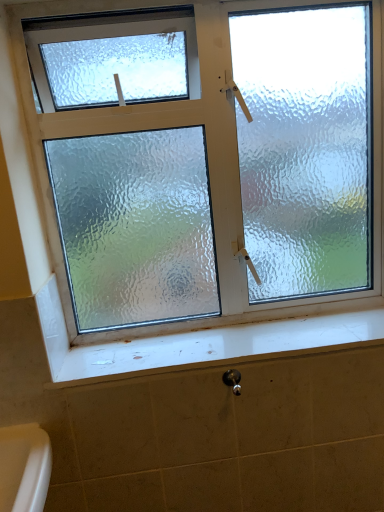
Identify the location of vacant area on top of white glossy window sill at lower center (from a real-world perspective). The width and height of the screenshot is (384, 512). (235, 337).